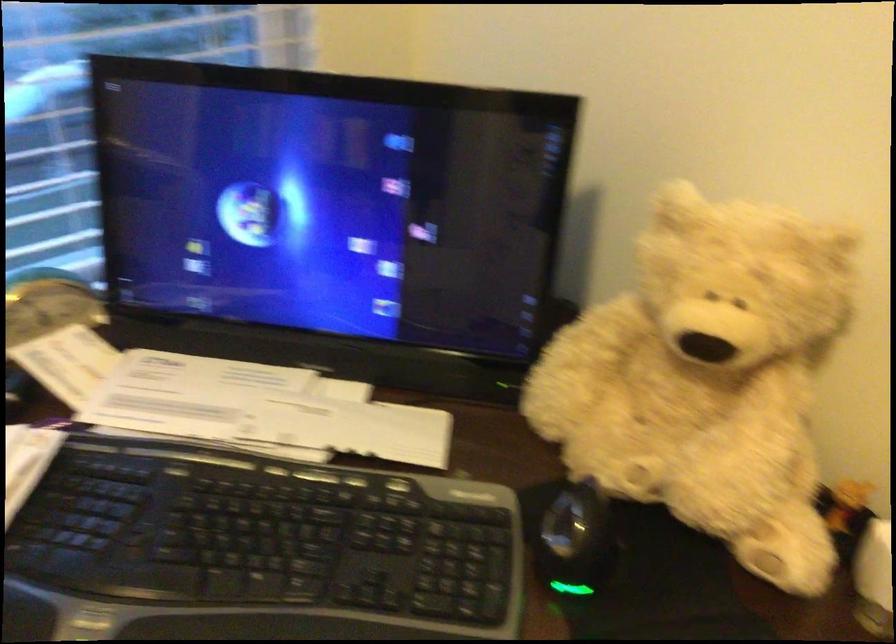
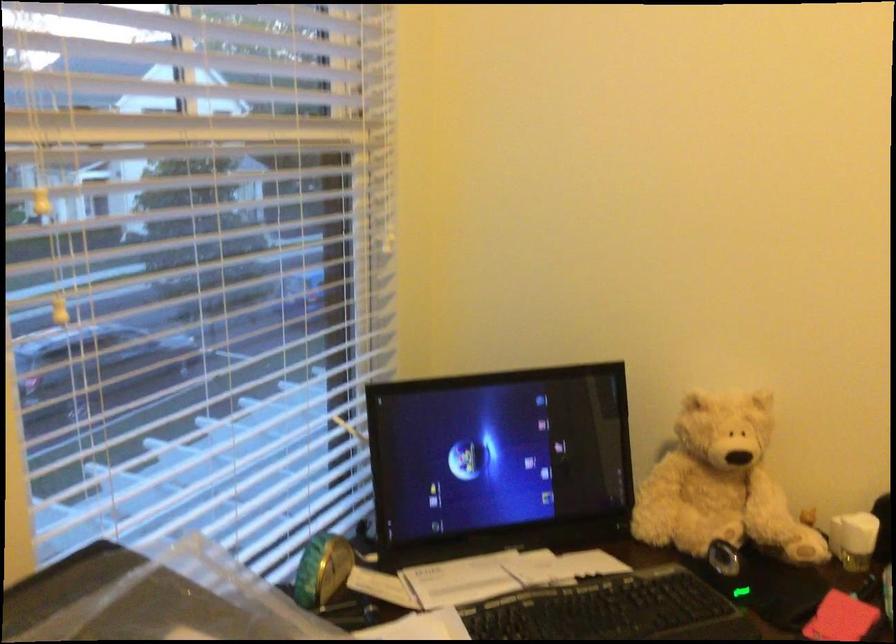
The point at (688, 390) is marked in the first image. Where is the corresponding point in the second image?

(720, 484)